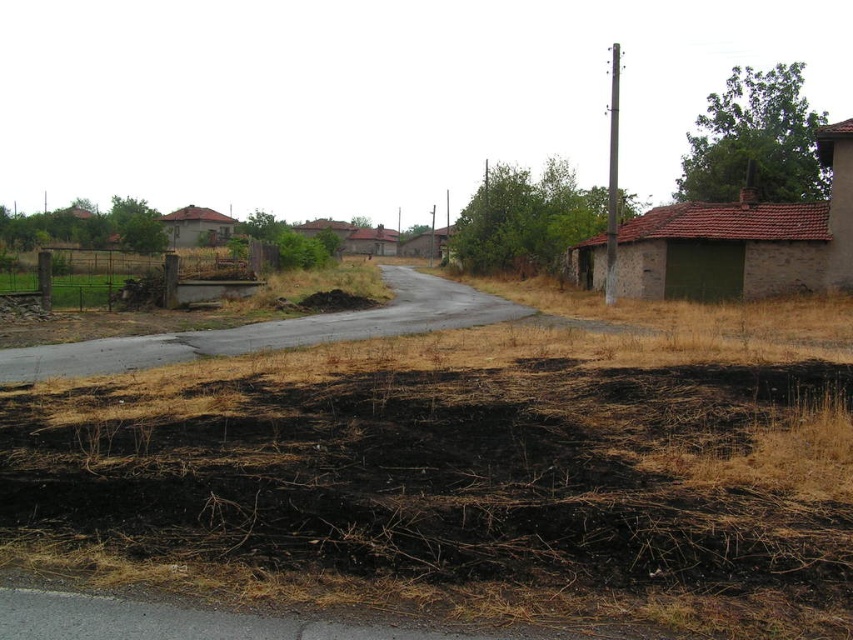
Question: Which of the following is the farthest from the observer?

Choices:
 (A) (642, 435)
 (B) (12, 289)

Answer: (B)

Question: Can you confirm if burnt dry grass at lower center is smaller than brown dry grass at left?

Choices:
 (A) no
 (B) yes

Answer: (B)

Question: Does burnt dry grass at lower center have a larger size compared to brown dry grass at left?

Choices:
 (A) no
 (B) yes

Answer: (A)

Question: Does burnt dry grass at lower center have a smaller size compared to brown dry grass at left?

Choices:
 (A) no
 (B) yes

Answer: (B)